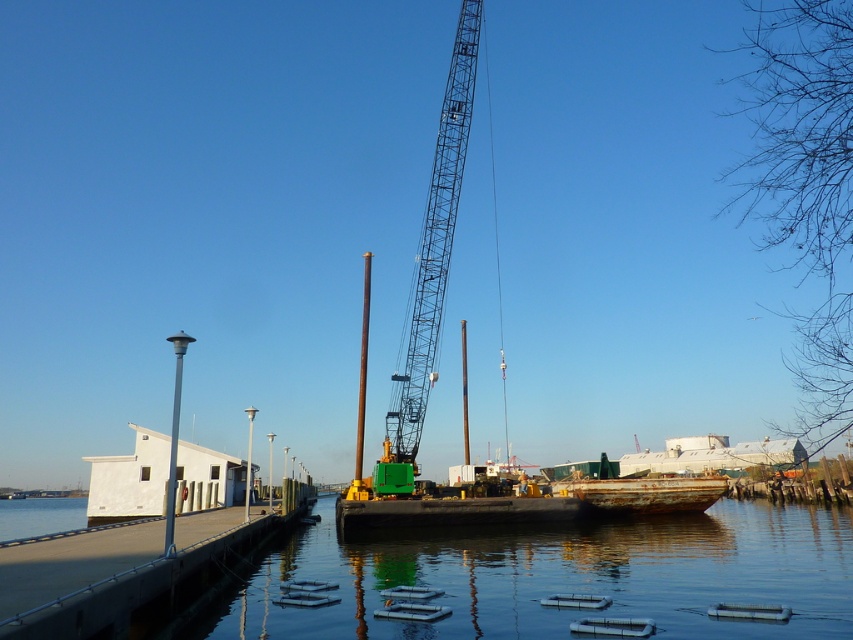
Is concrete dock at lower left wider than metallic blue crane at center?

In fact, concrete dock at lower left might be narrower than metallic blue crane at center.

Does point (9, 593) come farther from viewer compared to point (450, 224)?

No.

Who is more forward, (282, 531) or (405, 448)?

Point (282, 531) is in front.

I want to click on concrete dock at lower left, so click(126, 577).

Between concrete dock at lower left and rusty metal boat at lower right, which one is positioned lower?

rusty metal boat at lower right is lower down.

Does point (273, 531) come in front of point (659, 486)?

Yes, it is.

Locate an element on the screen. This screenshot has width=853, height=640. concrete dock at lower left is located at coordinates (126, 577).

Which is more to the left, clear water at dock center or concrete dock at lower left?

concrete dock at lower left

Which is behind, point (497, 566) or point (229, 560)?

Positioned behind is point (497, 566).

Locate an element on the screen. The width and height of the screenshot is (853, 640). clear water at dock center is located at coordinates point(561,577).